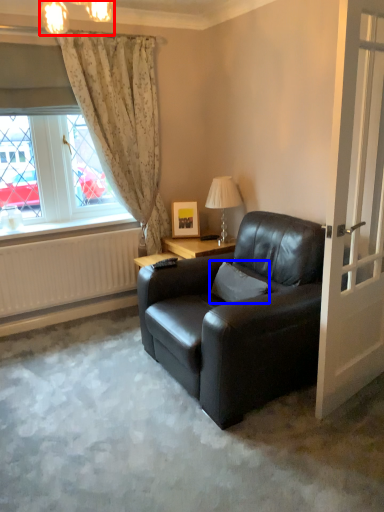
Question: Which of the following is the closest to the observer, lamp (highlighted by a red box) or pillow (highlighted by a blue box)?

Choices:
 (A) lamp
 (B) pillow

Answer: (A)